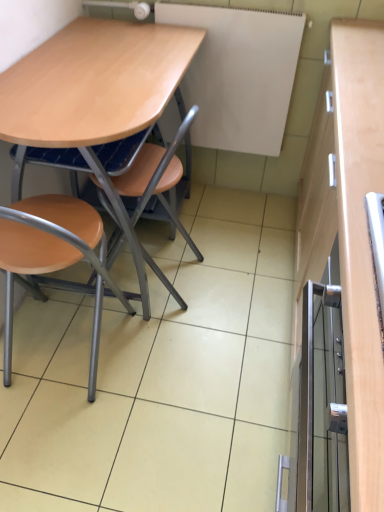
Question: Is point (235, 114) closer or farther from the camera than point (76, 106)?

Choices:
 (A) closer
 (B) farther

Answer: (B)

Question: Is white matte board at upper center inside the boundaries of light brown wood desk at center, or outside?

Choices:
 (A) inside
 (B) outside

Answer: (B)

Question: Which object is positioned closest to the light brown wood desk at center?

Choices:
 (A) white matte board at upper center
 (B) matte wood chair at lower left, which ranks as the second chair in right-to-left order
 (C) metallic silver cabinet at right
 (D) matte wood chair at center, which appears as the 2th chair when viewed from the left

Answer: (D)

Question: Considering the real-world distances, which object is closest to the white matte board at upper center?

Choices:
 (A) light brown wood desk at center
 (B) matte wood chair at lower left, which ranks as the second chair in right-to-left order
 (C) matte wood chair at center, which is counted as the first chair, starting from the right
 (D) metallic silver cabinet at right

Answer: (A)